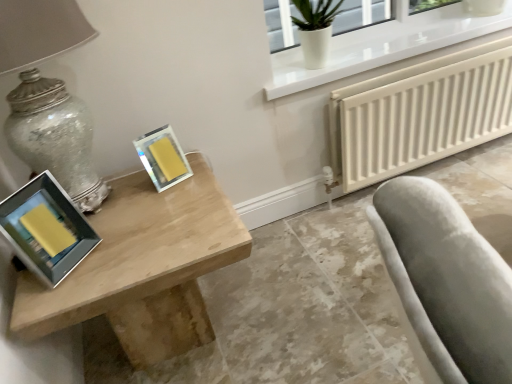
Question: Is matte yellow picture frame at left, marked as the 2th picture frame in a right-to-left arrangement, to the left of yellow matte picture frame at upper center, which is the first picture frame from back to front, from the viewer's perspective?

Choices:
 (A) yes
 (B) no

Answer: (A)

Question: From the image's perspective, is matte yellow picture frame at left, marked as the 2th picture frame in a right-to-left arrangement, on top of yellow matte picture frame at upper center, which is counted as the 2th picture frame, starting from the front?

Choices:
 (A) no
 (B) yes

Answer: (A)

Question: From a real-world perspective, is matte yellow picture frame at left, the first picture frame from the left, under yellow matte picture frame at upper center, which is the first picture frame from back to front?

Choices:
 (A) no
 (B) yes

Answer: (A)

Question: Is matte yellow picture frame at left, positioned as the 2th picture frame in back-to-front order, positioned beyond the bounds of yellow matte picture frame at upper center, which is the first picture frame from back to front?

Choices:
 (A) yes
 (B) no

Answer: (A)

Question: From the image's perspective, is matte yellow picture frame at left, marked as the 2th picture frame in a right-to-left arrangement, beneath yellow matte picture frame at upper center, which is the first picture frame from back to front?

Choices:
 (A) no
 (B) yes

Answer: (B)

Question: Is matte yellow picture frame at left, marked as the 2th picture frame in a right-to-left arrangement, aimed at yellow matte picture frame at upper center, which is counted as the 2th picture frame, starting from the front?

Choices:
 (A) no
 (B) yes

Answer: (A)

Question: Does light wood table at left come behind white textured radiator at lower right?

Choices:
 (A) no
 (B) yes

Answer: (A)

Question: Is light wood table at left directly adjacent to white textured radiator at lower right?

Choices:
 (A) no
 (B) yes

Answer: (A)

Question: From the image's perspective, does light wood table at left appear higher than white textured radiator at lower right?

Choices:
 (A) no
 (B) yes

Answer: (A)

Question: Is light wood table at left positioned with its back to white textured radiator at lower right?

Choices:
 (A) no
 (B) yes

Answer: (A)

Question: Is light wood table at left thinner than white textured radiator at lower right?

Choices:
 (A) no
 (B) yes

Answer: (A)

Question: Can you confirm if light wood table at left is positioned to the left of white textured radiator at lower right?

Choices:
 (A) yes
 (B) no

Answer: (A)

Question: Is matte glass table lamp at left further to the viewer compared to light wood table at left?

Choices:
 (A) no
 (B) yes

Answer: (A)